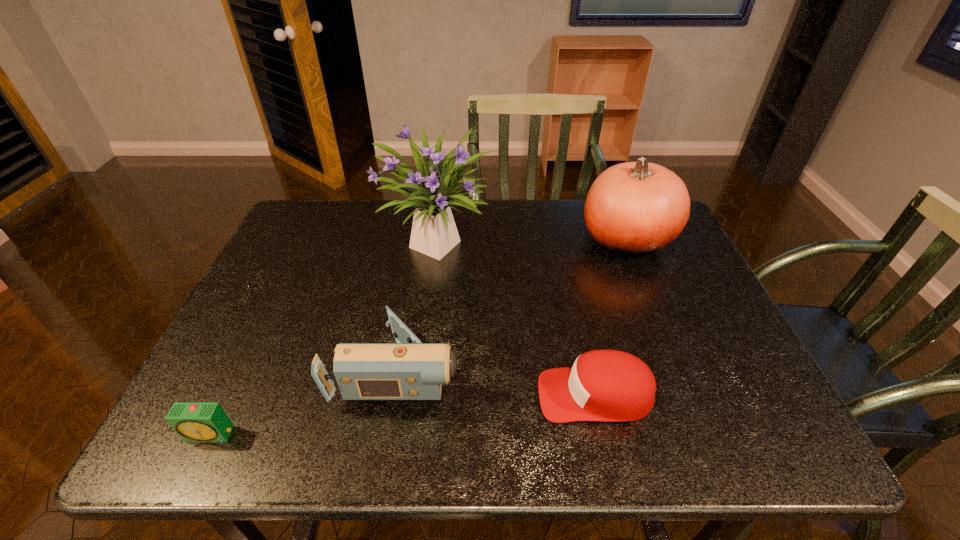
Identify the location of free space between the tallest object and the third tallest object. (420, 305).

Where is `empty space that is in between the second tallest object and the tallest object`? The width and height of the screenshot is (960, 540). empty space that is in between the second tallest object and the tallest object is located at coordinates (534, 239).

At what (x,y) coordinates should I click in order to perform the action: click on free space that is in between the tallest object and the baseball cap. Please return your answer as a coordinate pair (x, y). Looking at the image, I should click on (517, 318).

Find the location of a particular element. This screenshot has width=960, height=540. empty space that is in between the pumpkin and the alarm clock is located at coordinates (419, 336).

Locate an element on the screen. vacant area that lies between the pumpkin and the baseball cap is located at coordinates click(611, 316).

Find the location of a particular element. vacant area between the alarm clock and the flower arrangement is located at coordinates (325, 338).

Identify which object is the second closest to the shortest object. Please provide its 2D coordinates. Your answer should be formatted as a tuple, i.e. [(x, y)], where the tuple contains the x and y coordinates of a point satisfying the conditions above.

[(434, 233)]

Identify which object is the nearest to the leftmost object. Please provide its 2D coordinates. Your answer should be formatted as a tuple, i.e. [(x, y)], where the tuple contains the x and y coordinates of a point satisfying the conditions above.

[(409, 370)]

Identify the location of blank space that satisfies the following two spatial constraints: 1. on the back side of the flower arrangement; 2. on the right side of the pumpkin. This screenshot has width=960, height=540. (441, 238).

Find the location of `free spot that satisfies the following two spatial constraints: 1. on the side of the camcorder with the flip-out screen; 2. on the front-facing side of the shortest object`. free spot that satisfies the following two spatial constraints: 1. on the side of the camcorder with the flip-out screen; 2. on the front-facing side of the shortest object is located at coordinates (388, 434).